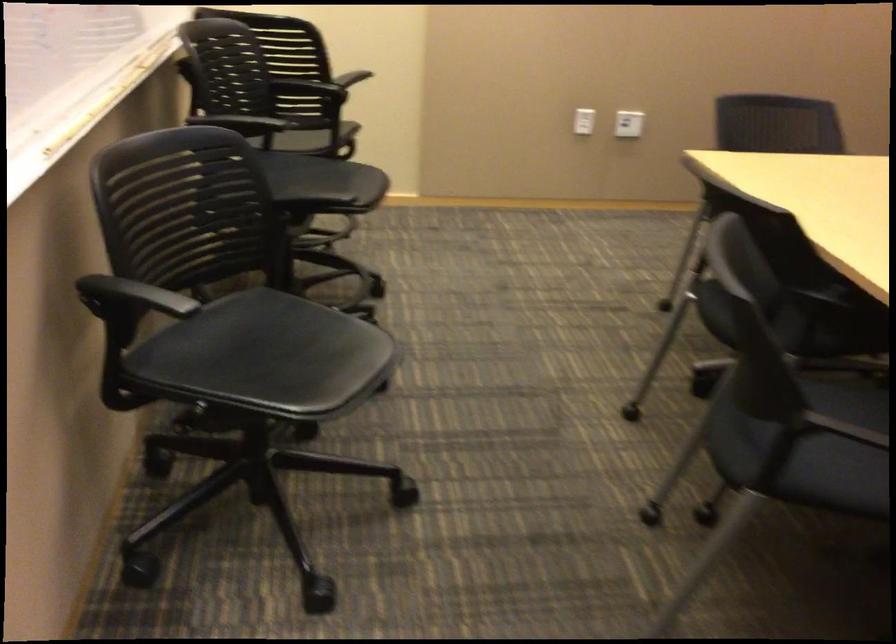
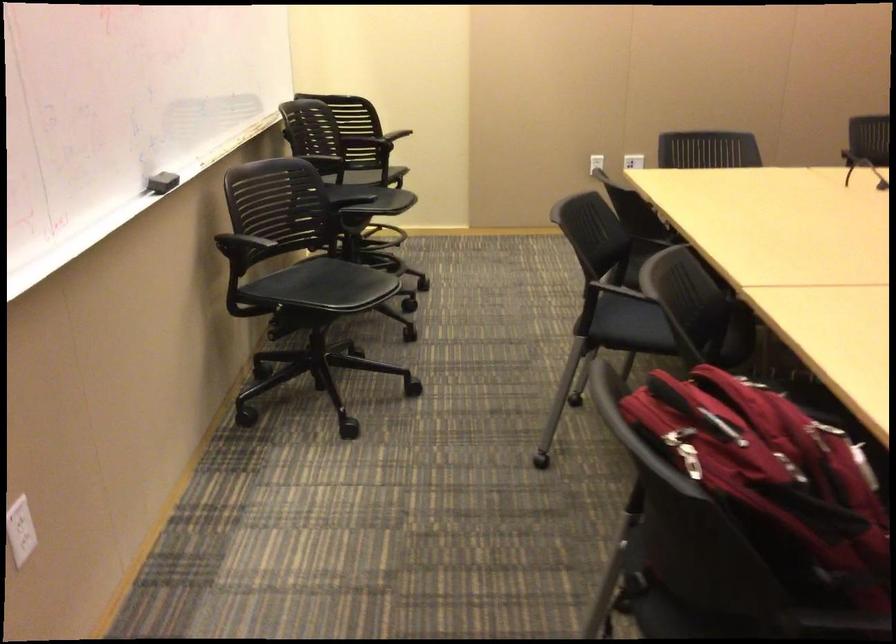
What movement of the cameraman would produce the second image?

The cameraman moved toward right, backward.